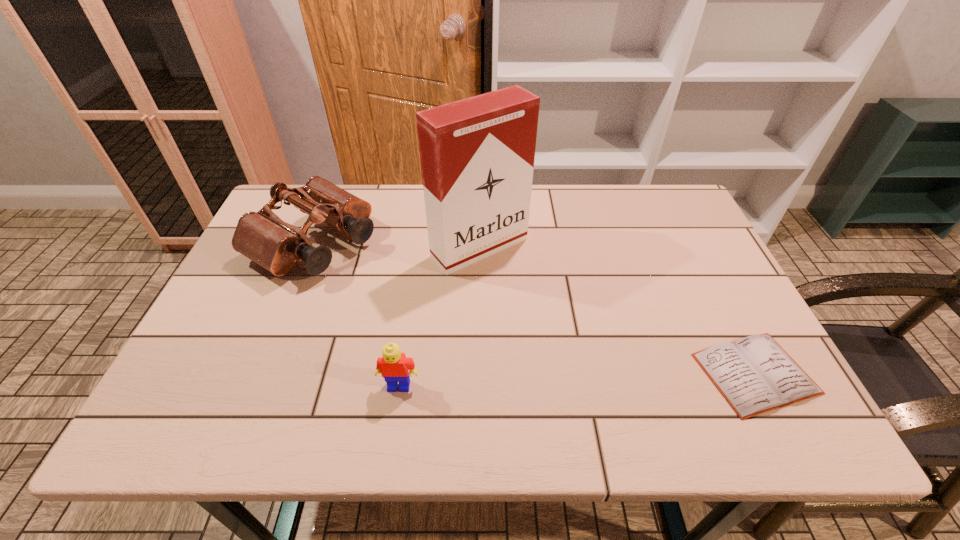
I want to click on object positioned at the near right corner, so click(755, 374).

This screenshot has height=540, width=960. In the image, there is a desktop. Identify the location of blank space at the far edge. (358, 185).

Where is `vacant region at the near edge of the desktop`? This screenshot has width=960, height=540. vacant region at the near edge of the desktop is located at coordinates (364, 371).

The image size is (960, 540). I want to click on free space at the left edge of the desktop, so click(255, 339).

This screenshot has width=960, height=540. Identify the location of vacant space at the right edge of the desktop. (716, 343).

Identify the location of free space at the far right corner of the desktop. (644, 187).

Find the location of a particular element. The height and width of the screenshot is (540, 960). free spot between the shortest object and the binoculars is located at coordinates (535, 308).

Locate an element on the screen. This screenshot has width=960, height=540. vacant space that's between the tallest object and the diary is located at coordinates (617, 310).

Locate an element on the screen. The image size is (960, 540). vacant point located between the cigarette_case and the second tallest object is located at coordinates (397, 245).

Locate an element on the screen. The width and height of the screenshot is (960, 540). free spot between the third tallest object and the cigarette_case is located at coordinates point(440,316).